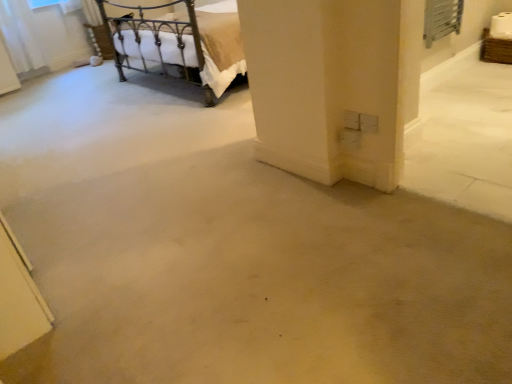
Question: Should I look upward or downward to see metallic wrought iron bed at upper left?

Choices:
 (A) down
 (B) up

Answer: (B)